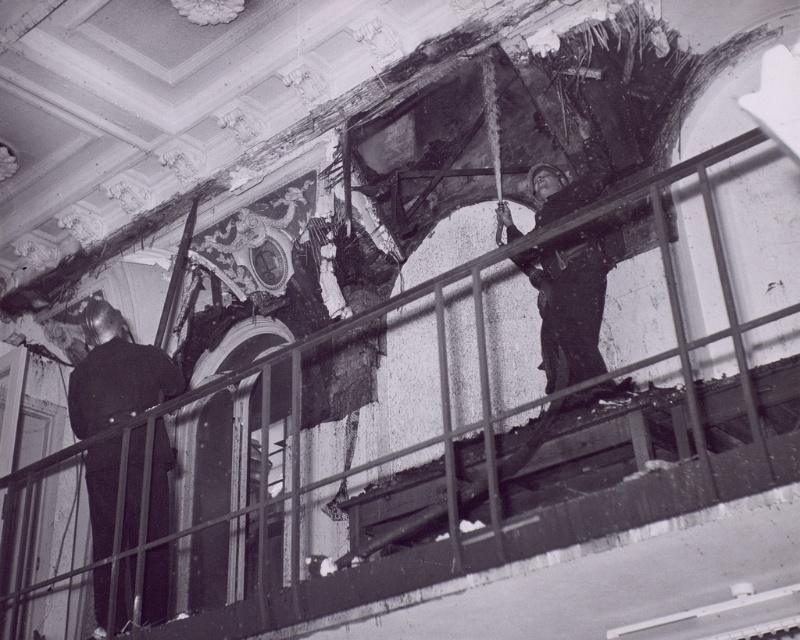
Question: Does dark fabric uniform at left appear on the left side of dark fabric helmet at upper center?

Choices:
 (A) no
 (B) yes

Answer: (B)

Question: Where is dark fabric uniform at left located in relation to dark fabric helmet at upper center in the image?

Choices:
 (A) above
 (B) below

Answer: (B)

Question: Is dark fabric uniform at left thinner than dark fabric helmet at upper center?

Choices:
 (A) no
 (B) yes

Answer: (A)

Question: Which point appears closest to the camera in this image?

Choices:
 (A) (592, 230)
 (B) (128, 589)

Answer: (B)

Question: Which point is closer to the camera taking this photo?

Choices:
 (A) (108, 540)
 (B) (564, 269)

Answer: (A)

Question: Which object appears farthest from the camera in this image?

Choices:
 (A) dark fabric uniform at left
 (B) dark fabric helmet at upper center

Answer: (B)